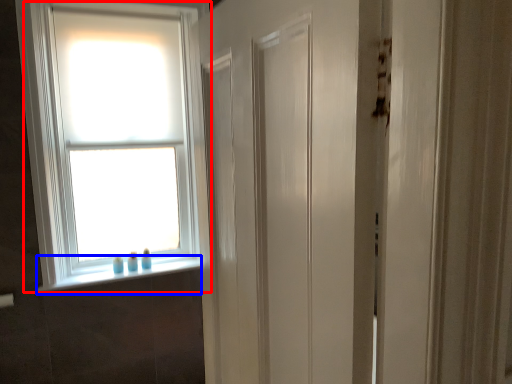
Question: Which object appears farthest to the camera in this image, window (highlighted by a red box) or window sill (highlighted by a blue box)?

Choices:
 (A) window
 (B) window sill

Answer: (B)